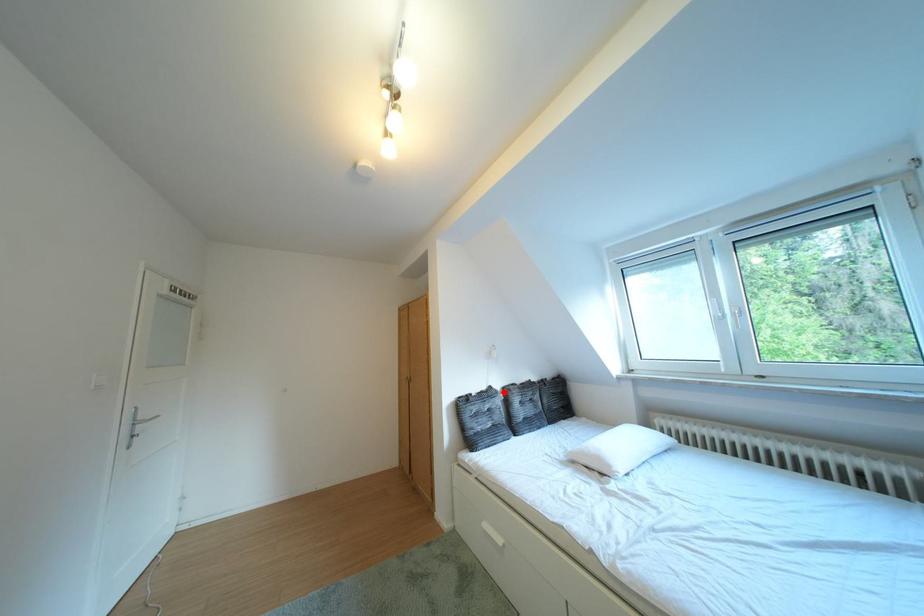
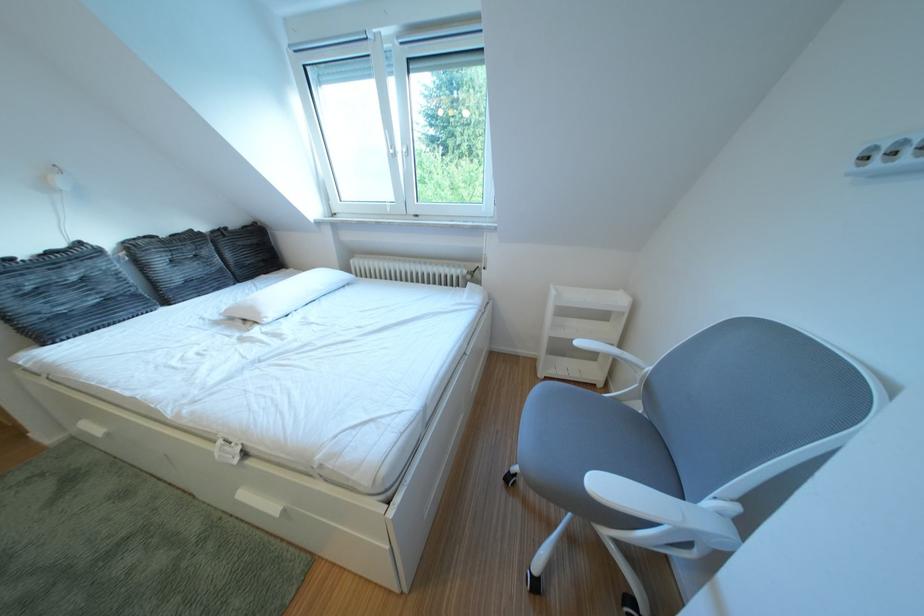
Question: I am providing you with two images of the same scene from different viewpoints. In image1, a red point is highlighted. Considering the same 3D point in image2, which of the following is correct?

Choices:
 (A) It is closer
 (B) It is farther

Answer: (A)